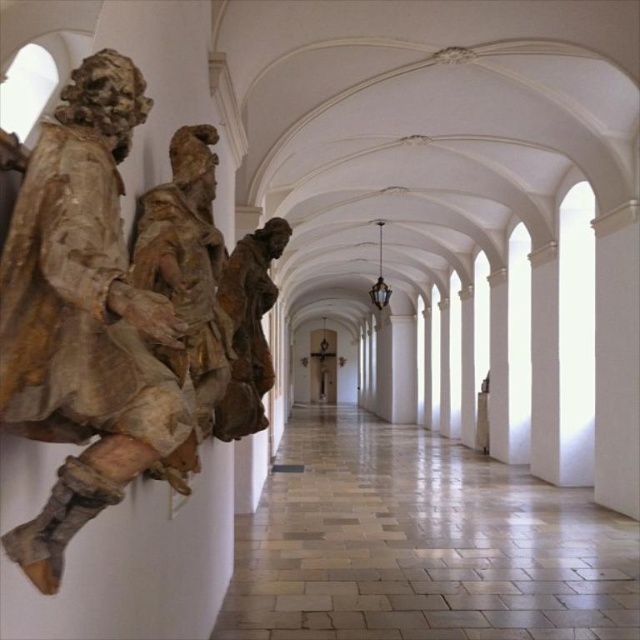
You are a tour guide leading a group through the corridor. You want to move a 10 feet long banner between the wooden statue at left and the matte brown statue at center. Is there enough space for the banner to fit between them?

The distance between the wooden statue at left and the matte brown statue at center is 8.62 feet, which is shorter than the 10 feet long banner. Therefore, the banner cannot fit between them.

You are an art curator planning to move the brown textured statue at center and the matte brown statue at center to a new exhibition space. The new space has a narrow shelf that can only accommodate items up to 1 meter wide. Which statue should you choose to fit on the shelf?

The brown textured statue at center has a smaller width than the matte brown statue at center, so it would fit better on the narrow shelf that can only accommodate items up to 1 meter wide.

You are standing in the corridor and want to touch both the brown textured statue at center and the matte brown statue at center. Which one can you reach first without moving your position?

The brown textured statue at center is closer to the viewer than the matte brown statue at center, so you can reach it first without moving.